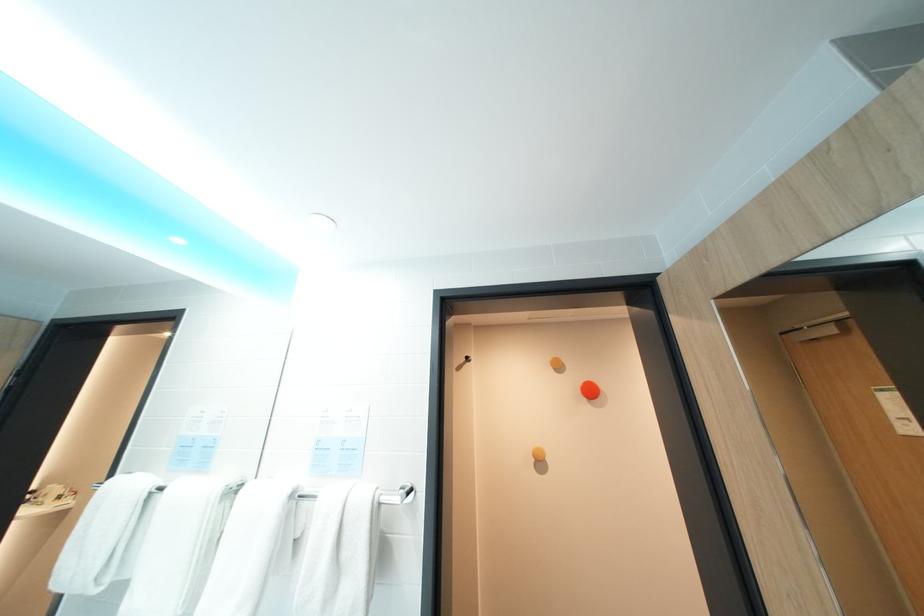
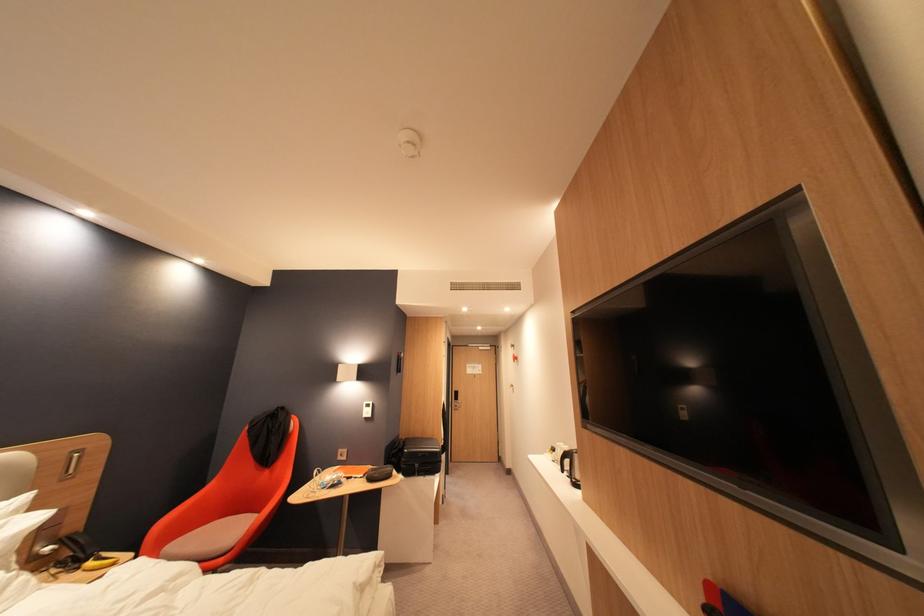
Question: I am providing you with two images of the same scene from different viewpoints. Please identify which objects are invisible in image2.

Choices:
 (A) white light switch
 (B) white towel
 (C) fan cage clip
 (D) silver door handle

Answer: (B)